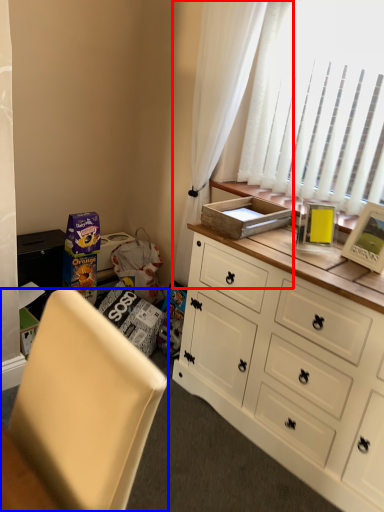
Question: Which object appears closest to the camera in this image, curtain (highlighted by a red box) or chair (highlighted by a blue box)?

Choices:
 (A) curtain
 (B) chair

Answer: (B)